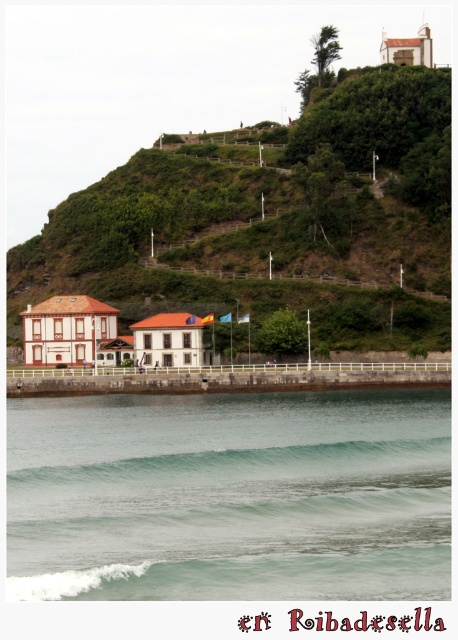
Can you confirm if clear water at lower center is thinner than green translucent wave at lower center?

Incorrect, clear water at lower center's width is not less than green translucent wave at lower center's.

Which is below, clear water at lower center or green translucent wave at lower center?

green translucent wave at lower center is lower down.

This screenshot has width=458, height=640. What are the coordinates of `clear water at lower center` in the screenshot? It's located at (229, 497).

Where is `clear water at lower center`? This screenshot has width=458, height=640. clear water at lower center is located at coordinates (229, 497).

Is point (278, 305) positioned before point (377, 456)?

No, (278, 305) is behind (377, 456).

Who is more forward, (x=45, y=237) or (x=123, y=465)?

Point (x=123, y=465) is in front.

The height and width of the screenshot is (640, 458). Find the location of `green grassy hillside at upper center`. green grassy hillside at upper center is located at coordinates pos(274,220).

Is point (392, 456) more distant than point (332, 177)?

No, (392, 456) is in front of (332, 177).

Can you confirm if clear water at lower center is taller than green grassy hillside at upper center?

No.

What do you see at coordinates (229, 497) in the screenshot? I see `clear water at lower center` at bounding box center [229, 497].

Identify the location of clear water at lower center. This screenshot has width=458, height=640. (229, 497).